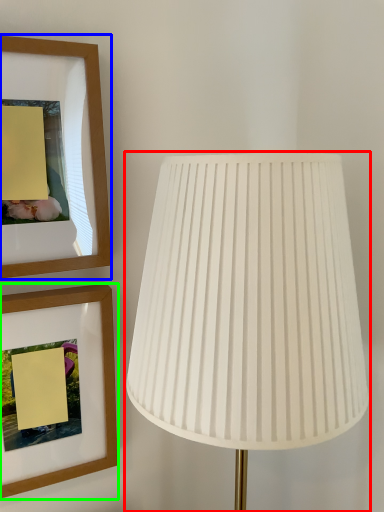
Question: Which object is positioned farthest from lamp (highlighted by a red box)? Select from picture frame (highlighted by a blue box) and picture frame (highlighted by a green box).

Choices:
 (A) picture frame
 (B) picture frame

Answer: (B)